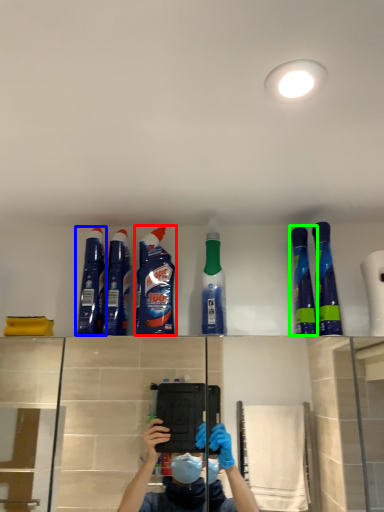
Question: Estimate the real-world distances between objects in this image. Which object is farther from cleaning product (highlighted by a red box), cleaning product (highlighted by a blue box) or cleaning product (highlighted by a green box)?

Choices:
 (A) cleaning product
 (B) cleaning product

Answer: (B)